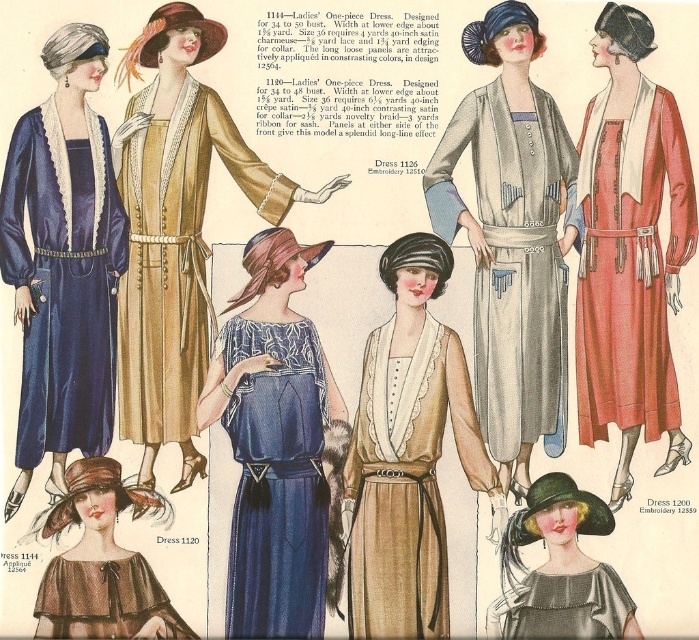
Question: Among these points, which one is nearest to the camera?

Choices:
 (A) (535, 577)
 (B) (80, 38)
 (C) (487, 269)
 (D) (3, 211)

Answer: (A)

Question: Among these objects, which one is farthest from the camera?

Choices:
 (A) matte blue silk dress at left
 (B) brown felt hat at lower left
 (C) green felt hat at lower center
 (D) matte gold dress at center

Answer: (D)

Question: Observing the image, what is the correct spatial positioning of matte brown fabric dress at lower left in reference to velvet brown hat at upper left?

Choices:
 (A) left
 (B) right

Answer: (A)

Question: Which is farther from the velvet brown hat at upper left?

Choices:
 (A) matte blue silk dress at left
 (B) matte blue silk dress at center
 (C) velvet-like brown hat at center
 (D) matte gold dress at center

Answer: (B)

Question: Where is brown textured blouse at lower left located in relation to silky beige blouse at lower center in the image?

Choices:
 (A) below
 (B) above

Answer: (B)

Question: Is matte red dress at right above matte gray fabric hat at upper left?

Choices:
 (A) no
 (B) yes

Answer: (A)